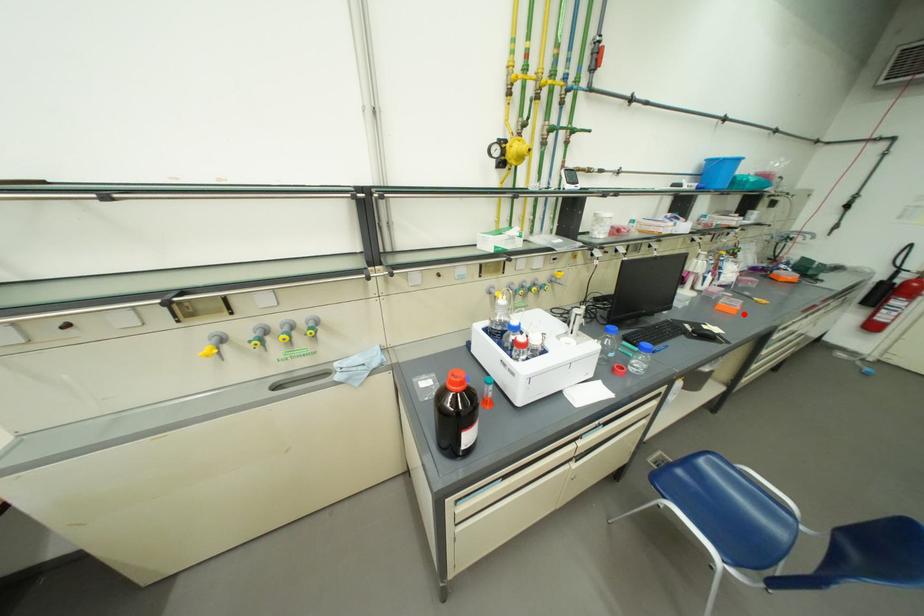
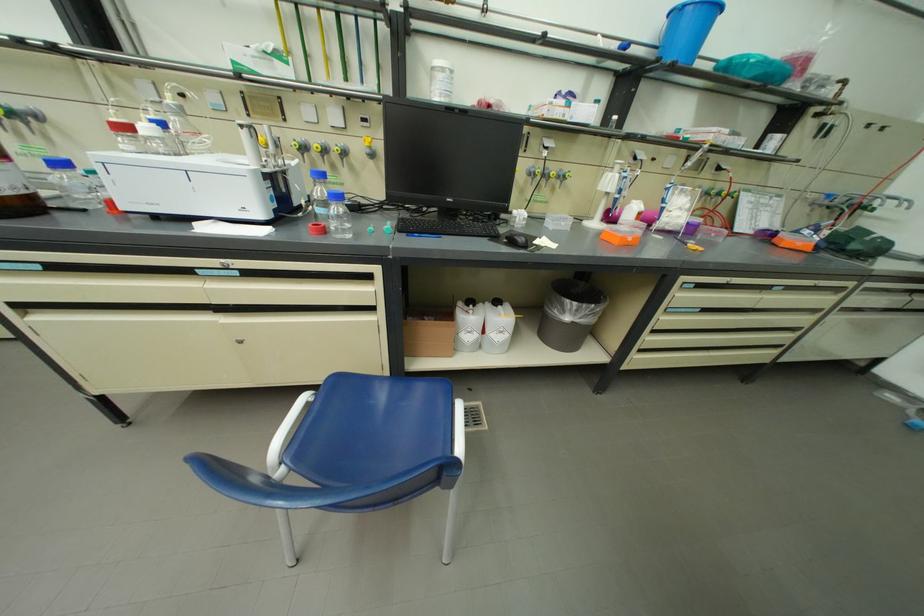
Question: I am providing you with two images of the same scene from different viewpoints. Image1 has a red point marked. In image2, the corresponding 3D location appears at what relative position? Reply with the corresponding letter.

Choices:
 (A) Closer
 (B) Farther

Answer: (A)